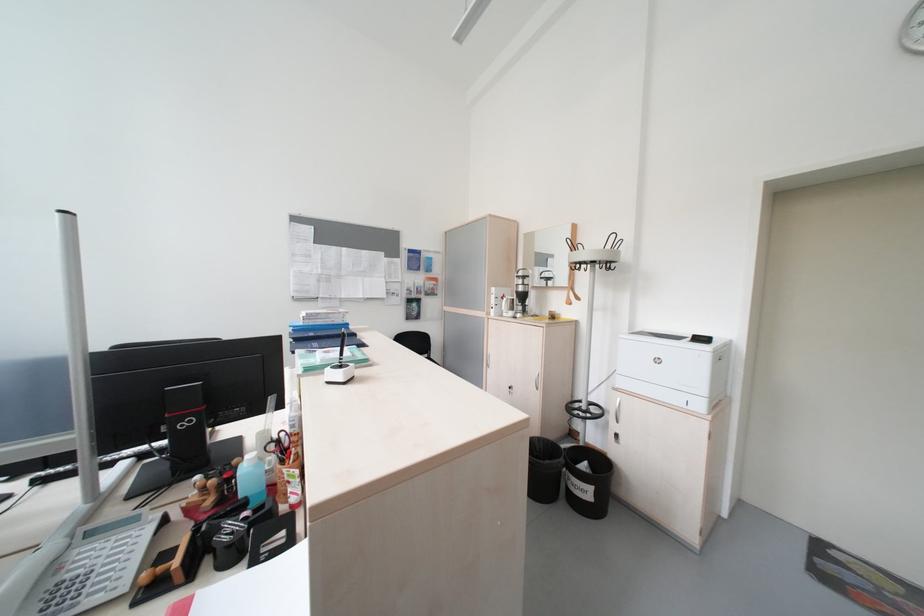
This screenshot has height=616, width=924. Find the location of `coat stand wheel`. coat stand wheel is located at coordinates (590, 318).